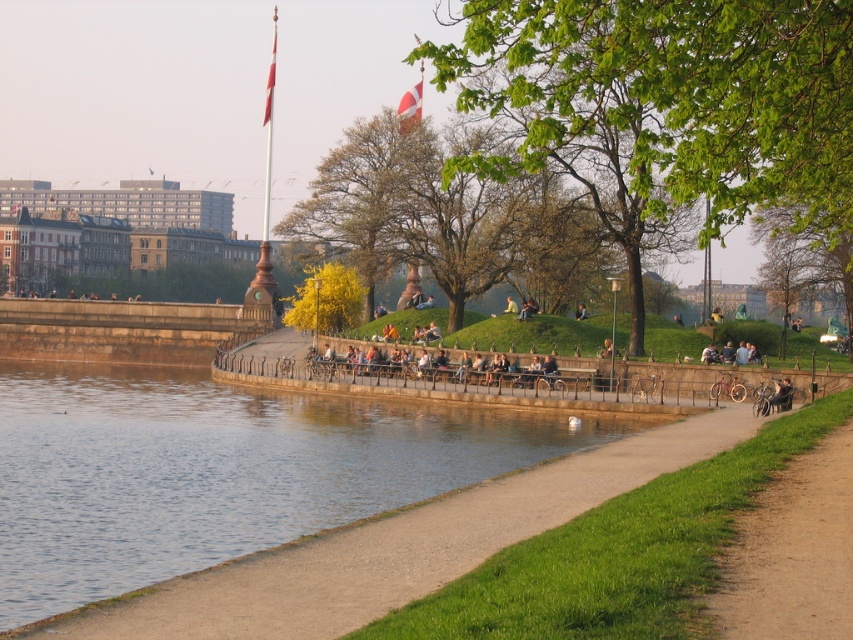
You are planning to take a photo of the clear water at lower left and the brown dirt path at lower right. Which object should you focus on first if you want to capture both in a single frame without moving the camera?

You should focus on the clear water at lower left first because it is larger in size than the brown dirt path at lower right, allowing it to be the main subject while still including the path in the frame.